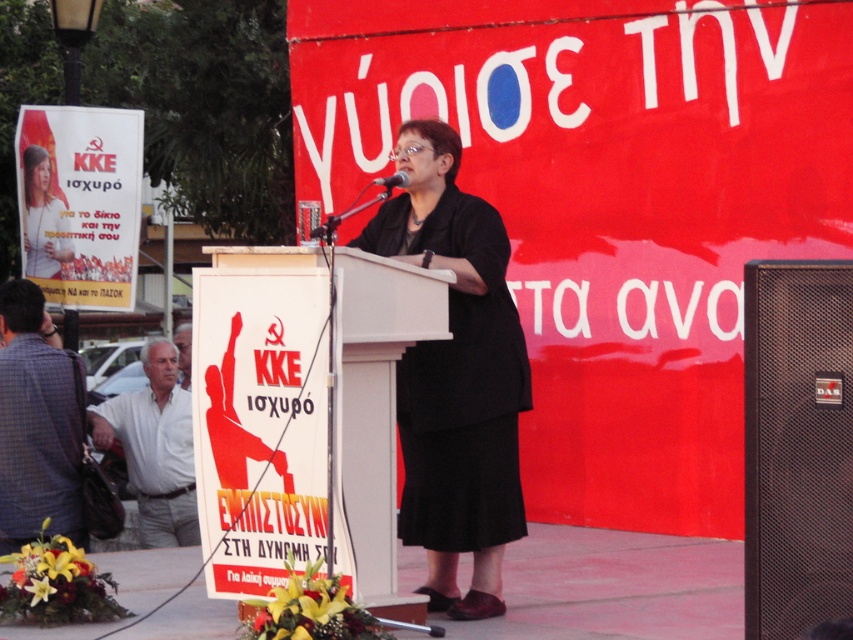
Is black mesh speaker at center thinner than matte black dress at center?

Correct, black mesh speaker at center's width is less than matte black dress at center's.

Is black mesh speaker at center closer to the viewer compared to matte black dress at center?

Yes, black mesh speaker at center is in front of matte black dress at center.

Is point (807, 387) positioned in front of point (35, 204)?

Yes.

Locate an element on the screen. black mesh speaker at center is located at coordinates (798, 444).

Between white wood podium at center and black matte dress at center, which one appears on the right side from the viewer's perspective?

black matte dress at center

Does white wood podium at center have a lesser width compared to black matte dress at center?

No, white wood podium at center is not thinner than black matte dress at center.

Image resolution: width=853 pixels, height=640 pixels. In order to click on white wood podium at center in this screenshot , I will do `click(259, 413)`.

Is black matte dress at center closer to camera compared to matte black dress at center?

Yes, it is.

Where is `black matte dress at center`? The image size is (853, 640). black matte dress at center is located at coordinates (463, 396).